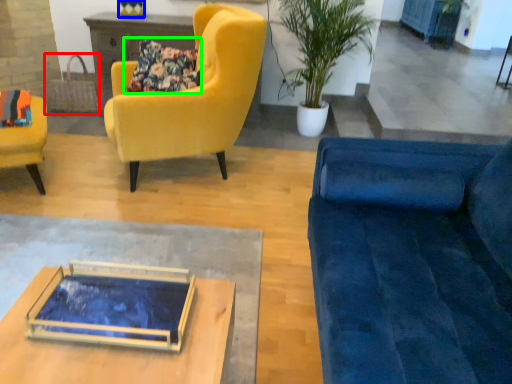
Question: Which object is positioned farthest from handbag (highlighted by a red box)? Select from vase (highlighted by a blue box) and pillow (highlighted by a green box).

Choices:
 (A) vase
 (B) pillow

Answer: (B)